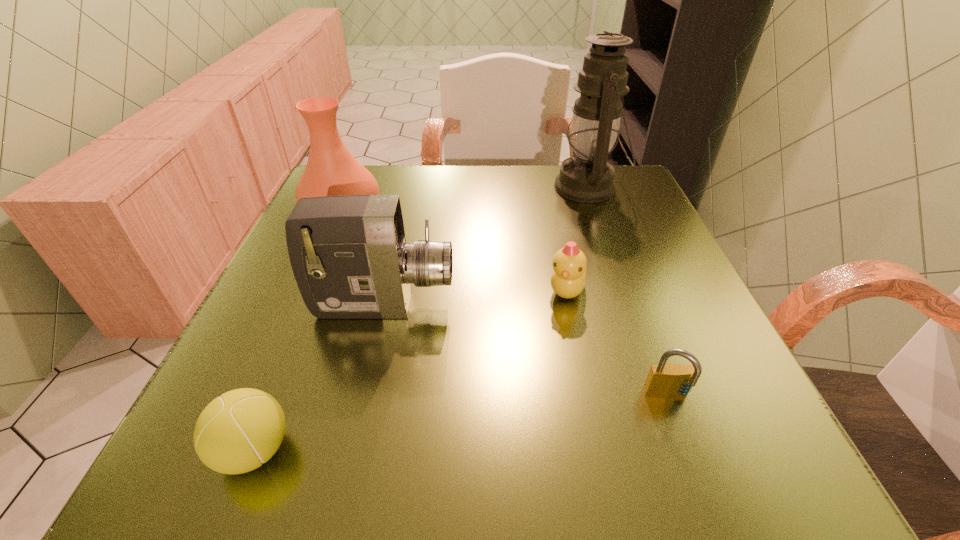
Identify the location of oil lamp. Image resolution: width=960 pixels, height=540 pixels. (587, 177).

Identify the location of vase. This screenshot has height=540, width=960. (331, 170).

Locate an element on the screen. This screenshot has height=540, width=960. the fourth shortest object is located at coordinates (349, 256).

Where is `duckling`? duckling is located at coordinates (568, 279).

You are a GUI agent. You are given a task and a screenshot of the screen. Output one action in this format:
    pyautogui.click(x=<x>, y=<y>)
    Task: Click on the padlock
    This screenshot has width=960, height=540.
    Given the screenshot: What is the action you would take?
    pyautogui.click(x=664, y=380)

I want to click on tennis ball, so click(x=237, y=432).

Locate an element on the screen. Image resolution: width=960 pixels, height=540 pixels. free space located on the left of the oil lamp is located at coordinates (492, 187).

Image resolution: width=960 pixels, height=540 pixels. In order to click on free region located on the front of the vase in this screenshot , I will do 311,288.

Locate an element on the screen. Image resolution: width=960 pixels, height=540 pixels. vacant space located 0.180m at the front of the fourth shortest object, highlighting the lens is located at coordinates (557, 305).

Where is `free point located on the front-facing side of the duckling`? The height and width of the screenshot is (540, 960). free point located on the front-facing side of the duckling is located at coordinates (593, 416).